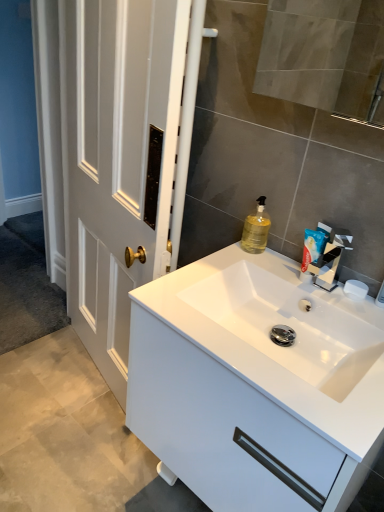
Where is `free space on the front side of translucent yellow liquid at sink right`? The image size is (384, 512). free space on the front side of translucent yellow liquid at sink right is located at coordinates (245, 266).